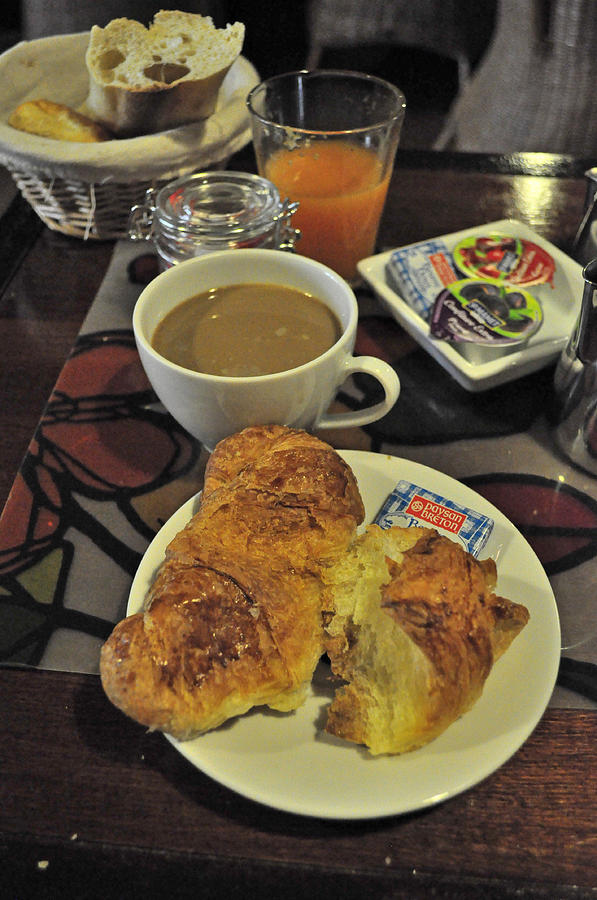
Find the location of `glass jar`. glass jar is located at coordinates (232, 222).